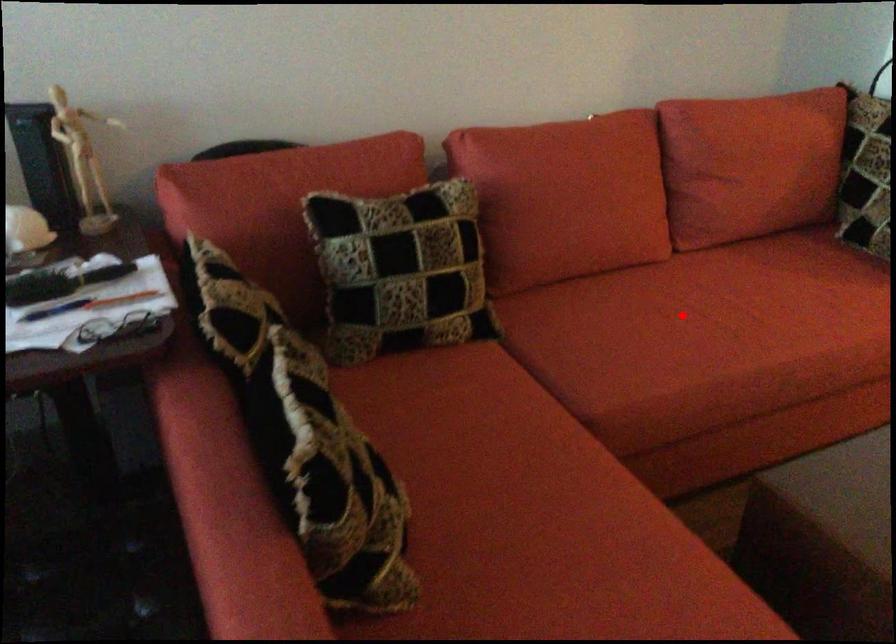
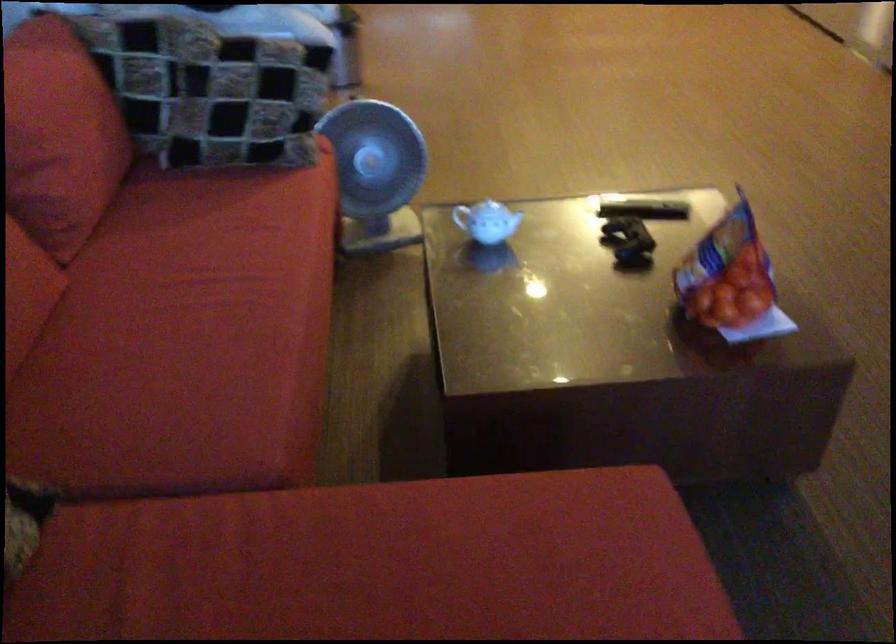
Question: I am providing you with two images of the same scene from different viewpoints. Given a red point in image1, look at the same physical point in image2. Is it:

Choices:
 (A) Closer to the viewpoint
 (B) Farther from the viewpoint

Answer: (A)